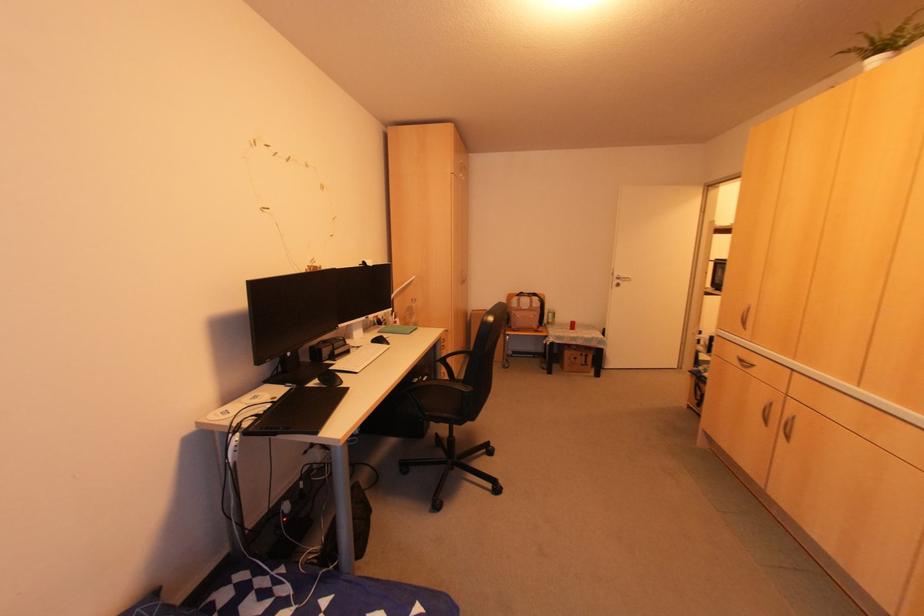
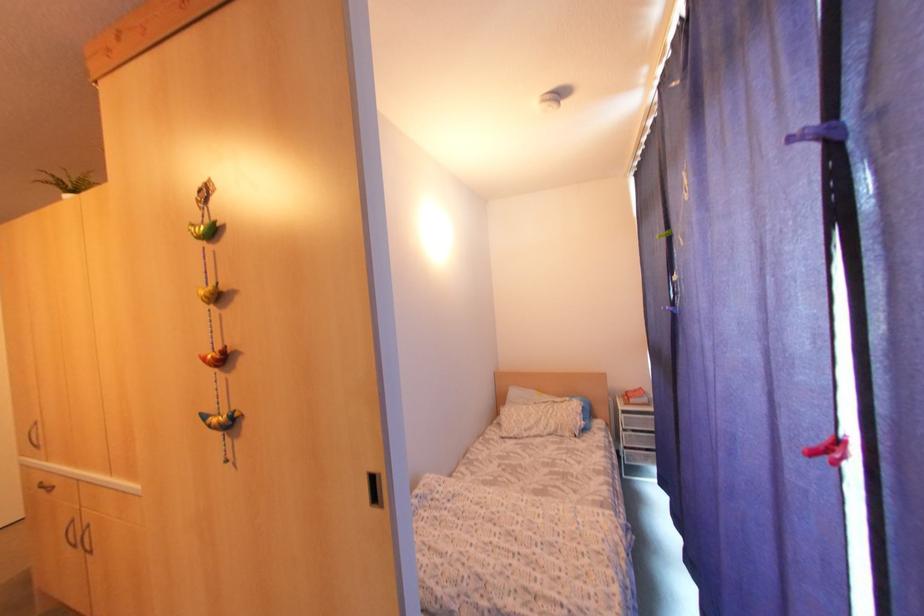
Locate, in the second image, the point that corresponds to [786,440] in the first image.

(90, 552)